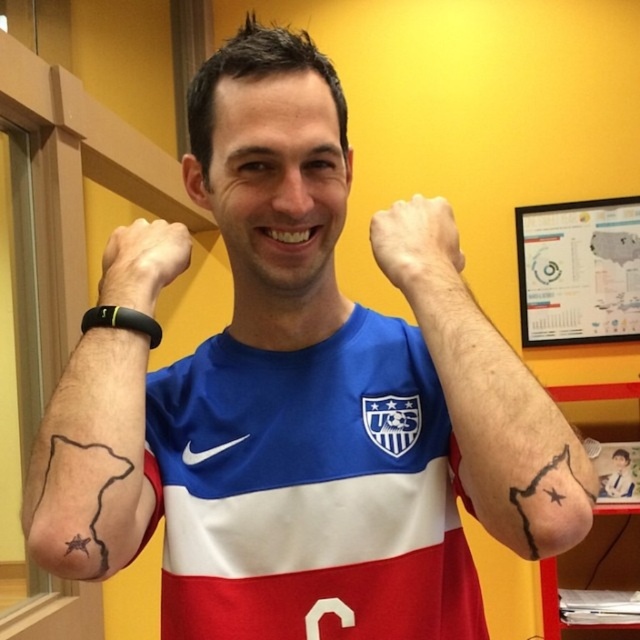
From the picture: Does black matte tattoo at upper left have a larger size compared to black ink bear at lower right?

Yes, black matte tattoo at upper left is bigger than black ink bear at lower right.

At what (x,y) coordinates should I click in order to perform the action: click on black matte tattoo at upper left. Please return your answer as a coordinate pair (x, y). This screenshot has width=640, height=640. Looking at the image, I should click on (92, 461).

Does black ink tattoo at upper right appear over black ink bear at lower right?

Yes, black ink tattoo at upper right is above black ink bear at lower right.

Does black ink tattoo at upper right appear on the left side of black ink bear at lower right?

Correct, you'll find black ink tattoo at upper right to the left of black ink bear at lower right.

Who is more forward, [380,216] or [560,484]?

Positioned in front is point [560,484].

The image size is (640, 640). Find the location of `black ink tattoo at upper right`. black ink tattoo at upper right is located at coordinates (486, 392).

Which is more to the left, black ink tattoo at upper right or black matte tattoo at upper left?

From the viewer's perspective, black matte tattoo at upper left appears more on the left side.

Is black ink tattoo at upper right wider than black matte tattoo at upper left?

Correct, the width of black ink tattoo at upper right exceeds that of black matte tattoo at upper left.

Is point (593, 477) in front of point (140, 358)?

Yes, it is.

At what (x,y) coordinates should I click in order to perform the action: click on black ink tattoo at upper right. Please return your answer as a coordinate pair (x, y). Looking at the image, I should click on (486, 392).